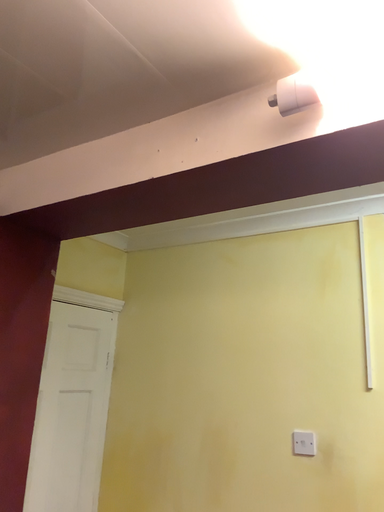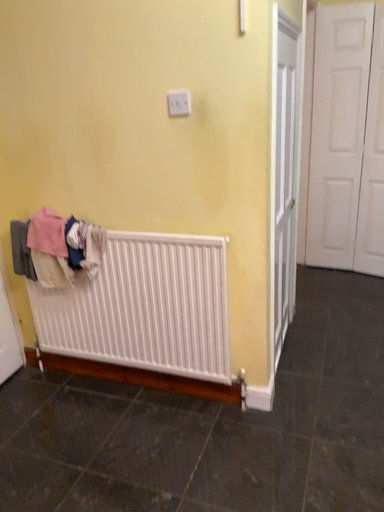
Question: How did the camera likely rotate when shooting the video?

Choices:
 (A) rotated left
 (B) rotated right

Answer: (B)